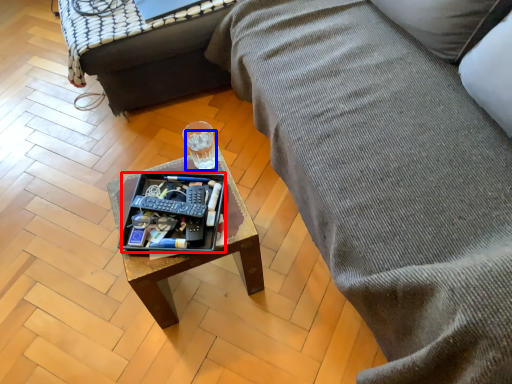
Question: Which object is closer to the camera taking this photo, tray (highlighted by a red box) or beverage (highlighted by a blue box)?

Choices:
 (A) tray
 (B) beverage

Answer: (A)